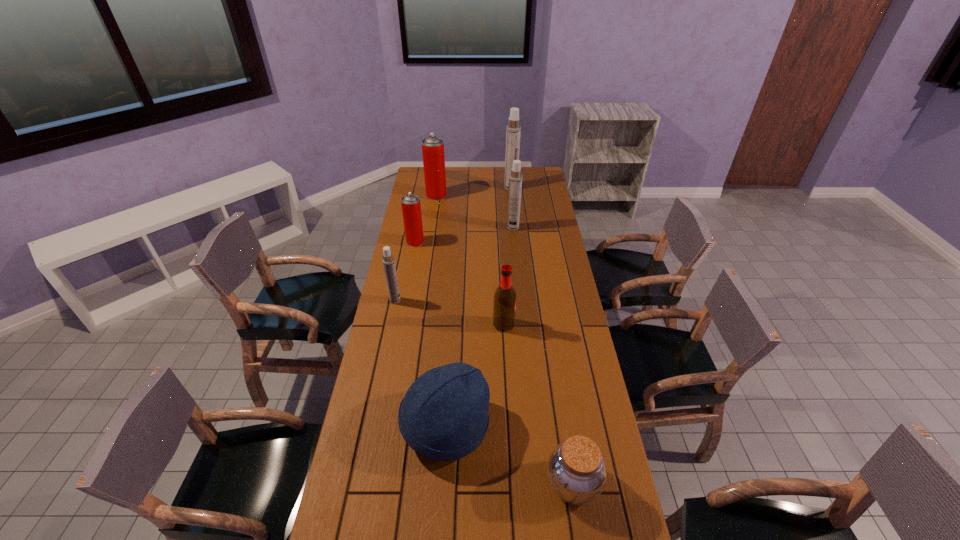
You are a GUI agent. You are given a task and a screenshot of the screen. Output one action in this format:
    pyautogui.click(x=<x>, y=<y>)
    Task: Click on the leftmost white aerosol can
    The image size is (960, 540).
    Given the screenshot: What is the action you would take?
    pyautogui.click(x=388, y=261)

The width and height of the screenshot is (960, 540). What are the coordinates of `skullcap` in the screenshot? It's located at (443, 416).

The width and height of the screenshot is (960, 540). I want to click on jar, so click(576, 471).

I want to click on free location located 0.310m on the front of the farthest white aerosol can, so click(x=515, y=222).

In order to click on vacant space located on the right of the farther red aerosol can in this screenshot , I will do `click(468, 195)`.

What are the coordinates of `vacant space situated on the left of the third nearest aerosol can` in the screenshot? It's located at (451, 228).

Find the location of `vacant space located on the left of the sixth farthest object`. vacant space located on the left of the sixth farthest object is located at coordinates (462, 325).

You are a GUI agent. You are given a task and a screenshot of the screen. Output one action in this format:
    pyautogui.click(x=<x>, y=<y>)
    Task: Click on the vacant space located on the back of the nearer red aerosol can
    Image resolution: width=960 pixels, height=540 pixels.
    Given the screenshot: What is the action you would take?
    pyautogui.click(x=424, y=194)

This screenshot has width=960, height=540. Identify the location of free region located on the right of the nearest white aerosol can. (481, 300).

Image resolution: width=960 pixels, height=540 pixels. I want to click on free space located on the back of the skullcap, so click(449, 359).